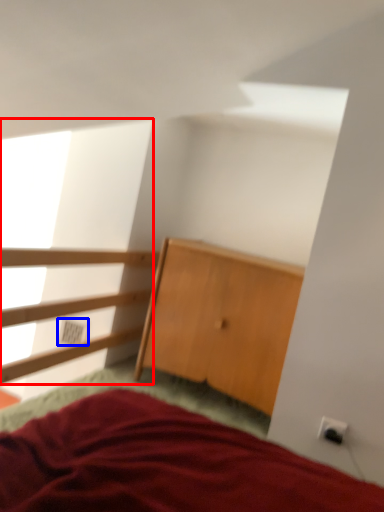
Question: Which point is closer to the camera, window screen (highlighted by a red box) or electric outlet (highlighted by a blue box)?

Choices:
 (A) window screen
 (B) electric outlet

Answer: (A)